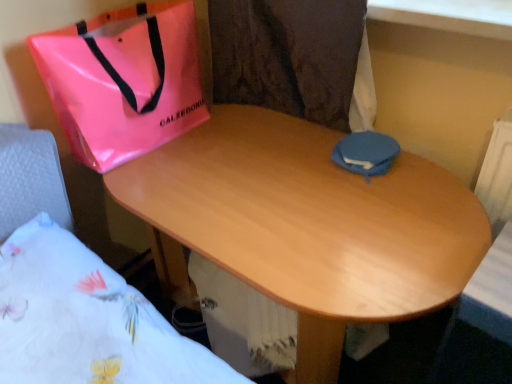
I want to click on free point above blue fabric pouch at center (from a real-world perspective), so click(362, 141).